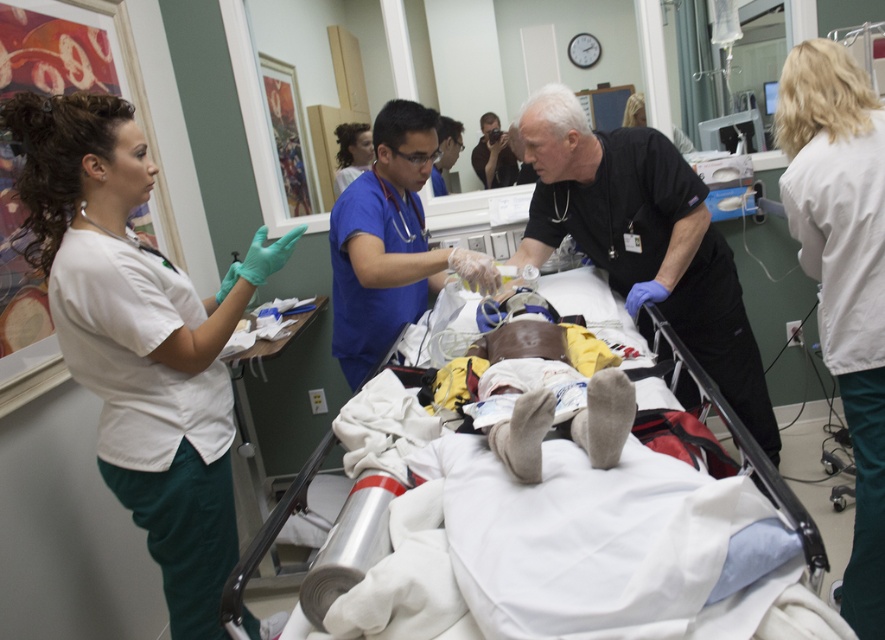
In the hospital scene, there is a black matte uniform at center and a white fabric hospital bed at center. From the perspective of someone standing at the entrance, which object is closer to the entrance?

The white fabric hospital bed at center is closer to the entrance because the black matte uniform at center is to the right of it, implying the bed is positioned more towards the front near the entrance.

In the hospital scene, there is a white smooth coat at upper right. Where exactly is it located in terms of coordinates?

The white smooth coat at upper right is located at coordinates point (843, 275).